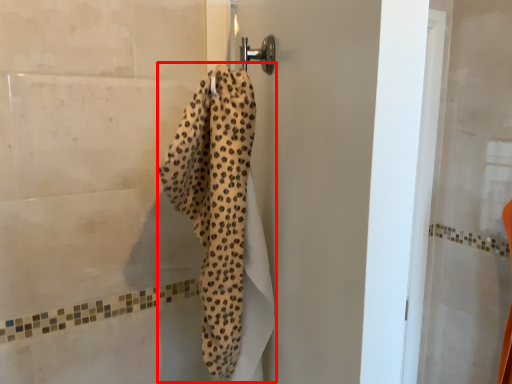
Question: From the image's perspective, what is the correct spatial positioning of bath towel (annotated by the red box) in reference to screen door?

Choices:
 (A) below
 (B) above

Answer: (B)